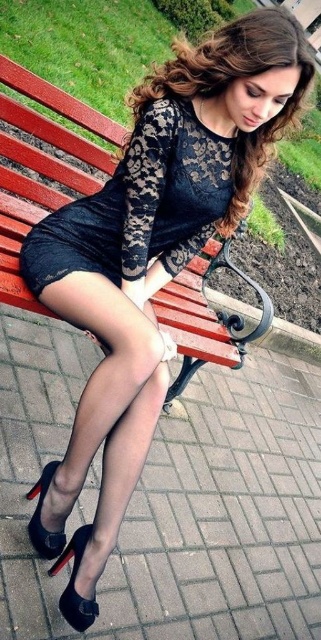
You are a photographer planning to take a portrait of the woman sitting on the wooden bench at center. Considering the lace fabric dress at center is wider than the bench, will the dress extend beyond the edges of the bench? Please explain.

The lace fabric dress at center is wider than the wooden bench at center, so yes, the dress will extend beyond the edges of the bench.

You are a photographer standing 1.5 meters away from the black sheer tights at lower center. Can you capture the entire scene without moving closer? Explain your reasoning.

The black sheer tights at lower center are 1.58 meters away from the viewer. Since you are already standing 1.5 meters away, you are slightly closer than the distance required to capture the entire scene. Moving back a small distance would allow you to include more of the background in your shot.